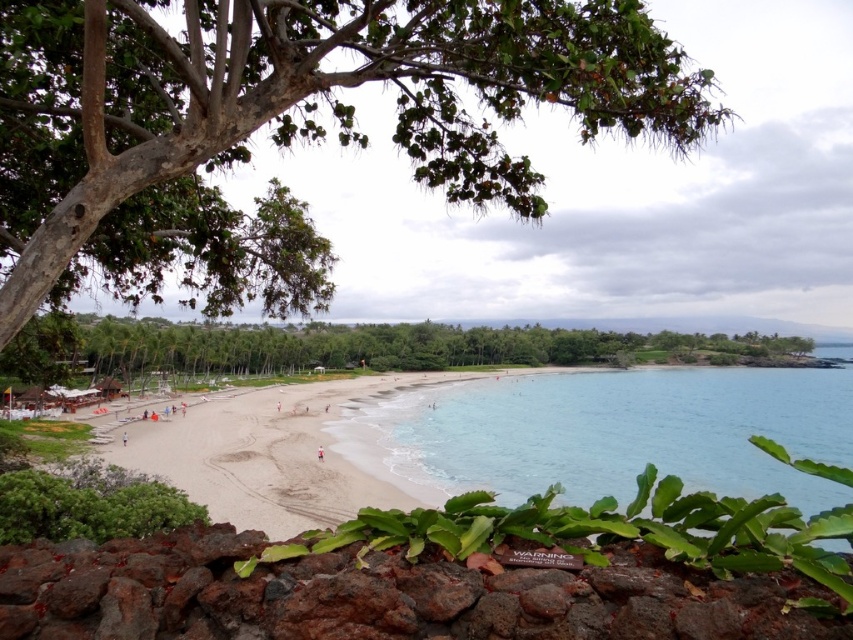
You are standing at the beach and want to walk towards the two points marked on the sand. Which point, point (128, 195) or point (474, 337), is closer to you?

Point (128, 195) is closer to the viewer than point (474, 337), so you should walk towards point (128, 195) first.

You are standing on the beach and looking towards the horizon. Which object, the green leafy tree at center or the white sandy beach at center, is positioned higher in the scene?

The green leafy tree at center is located above the white sandy beach at center, so it is positioned higher in the scene.

You are standing on the beach and want to take a photo of both the clear blue water at center and the green leafy tree at center. Since you have a wide angle lens, you need to know which one is narrower in width to frame them properly. Which object has a smaller width?

The clear blue water at center has a smaller width than the green leafy tree at center according to the description.